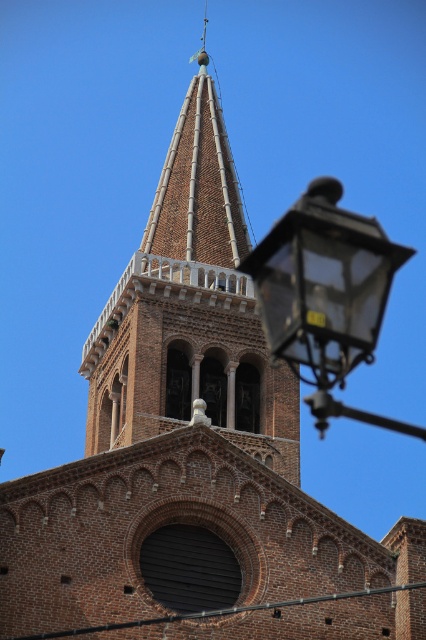
Is point (253, 435) more distant than point (290, 362)?

That is True.

Who is more distant from viewer, (x=180, y=180) or (x=316, y=198)?

The point (x=180, y=180) is more distant.

This screenshot has height=640, width=426. In order to click on brown brick tower at upper center in this screenshot , I will do `click(190, 310)`.